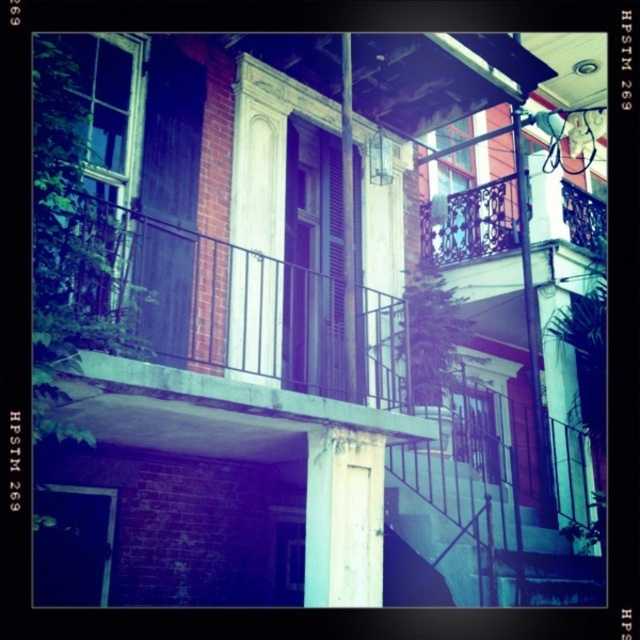
Does rustic wood balcony at center have a greater height compared to clear glass window at upper left?

Incorrect, rustic wood balcony at center's height is not larger of clear glass window at upper left's.

Does rustic wood balcony at center have a lesser width compared to clear glass window at upper left?

No, rustic wood balcony at center is not thinner than clear glass window at upper left.

Who is more forward, (403, 372) or (106, 188)?

Point (106, 188) is more forward.

The width and height of the screenshot is (640, 640). What are the coordinates of `rustic wood balcony at center` in the screenshot? It's located at (211, 305).

Which is more to the right, clear glass window at upper left or clear glass window at upper center?

clear glass window at upper center is more to the right.

Is point (48, 124) closer to viewer compared to point (467, 164)?

That is True.

Between point (60, 168) and point (445, 252), which one is positioned behind?

The point (445, 252) is more distant.

Locate an element on the screen. This screenshot has width=640, height=640. clear glass window at upper left is located at coordinates (84, 177).

Does rustic wood balcony at center appear on the left side of clear glass window at upper center?

Correct, you'll find rustic wood balcony at center to the left of clear glass window at upper center.

What do you see at coordinates (211, 305) in the screenshot?
I see `rustic wood balcony at center` at bounding box center [211, 305].

Where is `rustic wood balcony at center`? This screenshot has width=640, height=640. rustic wood balcony at center is located at coordinates click(x=211, y=305).